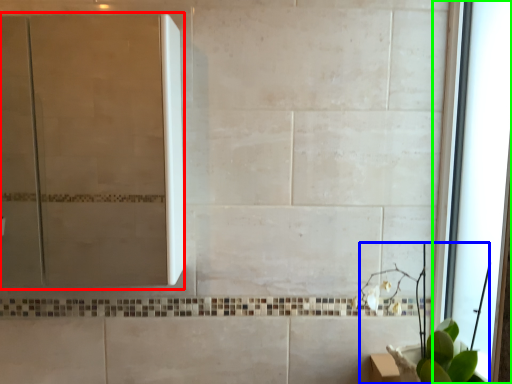
Question: Estimate the real-world distances between objects in this image. Which object is farther from screen door (highlighted by a red box), plant (highlighted by a blue box) or window (highlighted by a green box)?

Choices:
 (A) plant
 (B) window

Answer: (A)